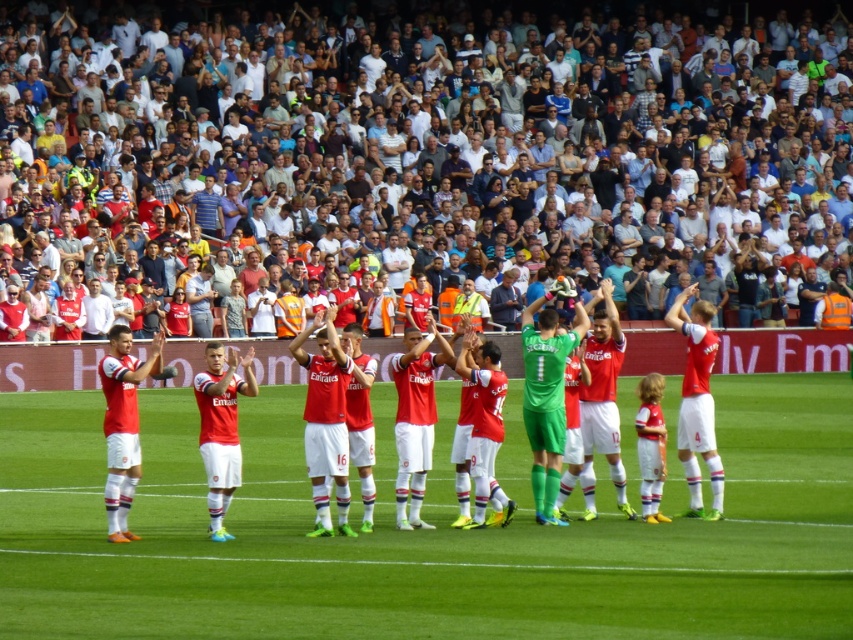
Can you confirm if white cotton crowd at upper center is smaller than matte red jersey at center?

No.

Consider the image. Who is lower down, white cotton crowd at upper center or matte red jersey at center?

matte red jersey at center is below.

Which is behind, point (822, 29) or point (546, 417)?

Positioned behind is point (822, 29).

Where is `white cotton crowd at upper center`? Image resolution: width=853 pixels, height=640 pixels. white cotton crowd at upper center is located at coordinates (543, 40).

Who is more distant from viewer, (88,572) or (408,1)?

The point (408,1) is behind.

This screenshot has width=853, height=640. What do you see at coordinates (421, 532) in the screenshot? I see `green grass football field at center` at bounding box center [421, 532].

Where is `green grass football field at center`? The image size is (853, 640). green grass football field at center is located at coordinates (421, 532).

Can you confirm if green grass football field at center is positioned to the right of matte red jersey at center?

In fact, green grass football field at center is to the left of matte red jersey at center.

In the scene shown: Is the position of green grass football field at center less distant than that of matte red jersey at center?

Yes, it is in front of matte red jersey at center.

Which is in front, point (49, 406) or point (708, 372)?

Positioned in front is point (708, 372).

I want to click on green grass football field at center, so click(421, 532).